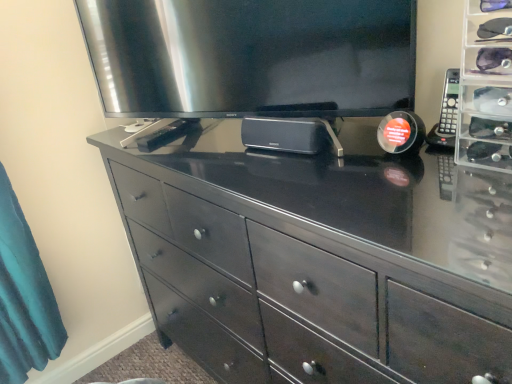
Where is `free space in front of black plastic remote at right`? free space in front of black plastic remote at right is located at coordinates (458, 185).